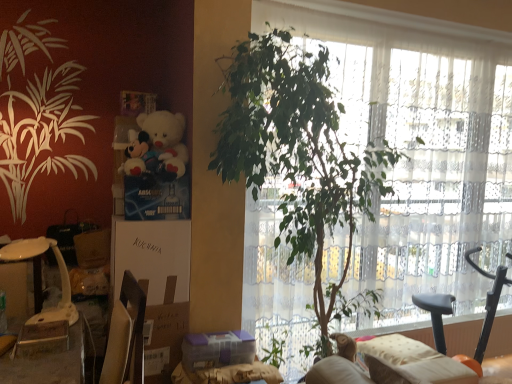
Question: Does green leafy plant at center have a lesser width compared to white plush toy at upper left?

Choices:
 (A) no
 (B) yes

Answer: (A)

Question: Is green leafy plant at center further to the viewer compared to white plush toy at upper left?

Choices:
 (A) yes
 (B) no

Answer: (B)

Question: Is the position of green leafy plant at center less distant than that of white plush toy at upper left?

Choices:
 (A) yes
 (B) no

Answer: (A)

Question: Is green leafy plant at center facing towards white plush toy at upper left?

Choices:
 (A) yes
 (B) no

Answer: (B)

Question: Can you see green leafy plant at center touching white plush toy at upper left?

Choices:
 (A) no
 (B) yes

Answer: (A)

Question: Looking at their shapes, would you say transparent glass window at center is wider or thinner than beige fabric couch at lower right?

Choices:
 (A) thin
 (B) wide

Answer: (A)

Question: Considering their positions, is transparent glass window at center located in front of or behind beige fabric couch at lower right?

Choices:
 (A) front
 (B) behind

Answer: (B)

Question: Considering the positions of point (417, 54) and point (400, 337), is point (417, 54) closer or farther from the camera than point (400, 337)?

Choices:
 (A) farther
 (B) closer

Answer: (A)

Question: From a real-world perspective, is transparent glass window at center positioned above or below beige fabric couch at lower right?

Choices:
 (A) above
 (B) below

Answer: (A)

Question: Considering the positions of white cardboard box at center-left, marked as the 1th cardboard box in a top-to-bottom arrangement, and white plush toy at upper left in the image, is white cardboard box at center-left, marked as the 1th cardboard box in a top-to-bottom arrangement, wider or thinner than white plush toy at upper left?

Choices:
 (A) wide
 (B) thin

Answer: (A)

Question: Considering the positions of white cardboard box at center-left, which is the second cardboard box in bottom-to-top order, and white plush toy at upper left in the image, is white cardboard box at center-left, which is the second cardboard box in bottom-to-top order, bigger or smaller than white plush toy at upper left?

Choices:
 (A) big
 (B) small

Answer: (A)

Question: Is white cardboard box at center-left, which is the second cardboard box in bottom-to-top order, in front of or behind white plush toy at upper left in the image?

Choices:
 (A) behind
 (B) front

Answer: (A)

Question: Is white cardboard box at center-left, which is the second cardboard box in bottom-to-top order, spatially inside white plush toy at upper left, or outside of it?

Choices:
 (A) outside
 (B) inside

Answer: (A)

Question: Considering the positions of white plastic table at lower left and brown cardboard box at lower left, placed as the 2th cardboard box when sorted from top to bottom, in the image, is white plastic table at lower left taller or shorter than brown cardboard box at lower left, placed as the 2th cardboard box when sorted from top to bottom,?

Choices:
 (A) short
 (B) tall

Answer: (A)

Question: Considering the positions of point (7, 258) and point (147, 309), is point (7, 258) closer or farther from the camera than point (147, 309)?

Choices:
 (A) farther
 (B) closer

Answer: (B)